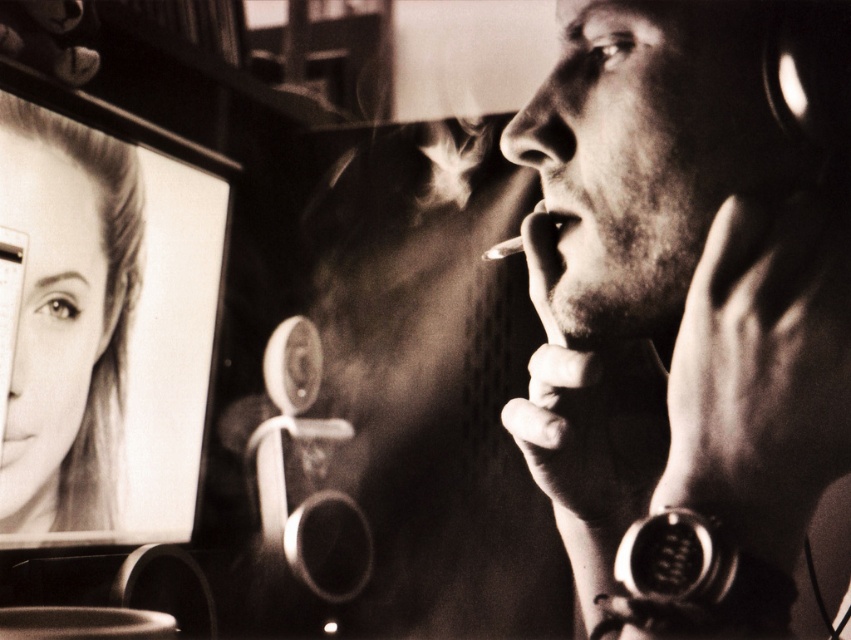
In the vintage photograph, there are two faces with smooth skin. The first is the smooth skin face at right, and the second is the smooth skin face at upper left. Which of these two faces is positioned more to the right side of the image?

The smooth skin face at right is positioned more to the right side of the image than the smooth skin face at upper left.

In the vintage photograph, you notice two features on the television screen showing the woman. The smooth skin face at right and the smooth skin mouth at center. Which one has a greater width?

The smooth skin face at right has a greater width than the smooth skin mouth at center.

You are an artist analyzing a photograph. You notice the smooth skin face at right and the smooth skin mouth at center. Which of these two elements occupies a more prominent position in the image?

The smooth skin face at right occupies a more prominent position because it has a larger size compared to the smooth skin mouth at center.